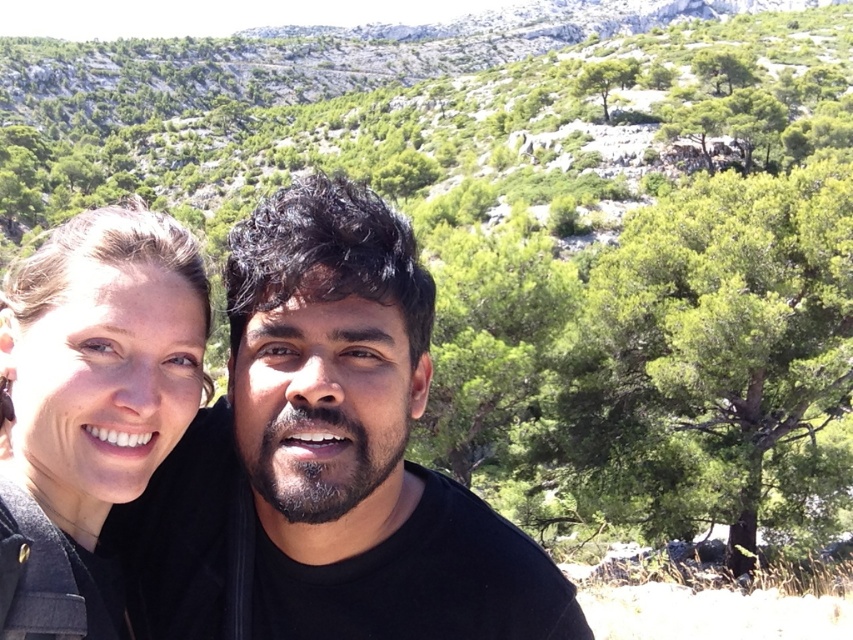
Question: Which object is closer to the camera taking this photo?

Choices:
 (A) black matte shirt at center
 (B) green leafy tree at upper center

Answer: (A)

Question: Is black matte shirt at center above green leafy tree at upper center?

Choices:
 (A) yes
 (B) no

Answer: (B)

Question: From the image, what is the correct spatial relationship of green leafy tree at upper right in relation to green leafy tree at upper center?

Choices:
 (A) below
 (B) above

Answer: (A)

Question: In this image, where is matte black jacket at left located relative to green leafy tree at upper center?

Choices:
 (A) left
 (B) right

Answer: (A)

Question: Which object appears closest to the camera in this image?

Choices:
 (A) green leafy tree at upper center
 (B) matte black jacket at left
 (C) green leafy tree at upper right

Answer: (B)

Question: Which object is the closest to the green leafy tree at upper center?

Choices:
 (A) matte black jacket at left
 (B) green leafy tree at upper right

Answer: (B)